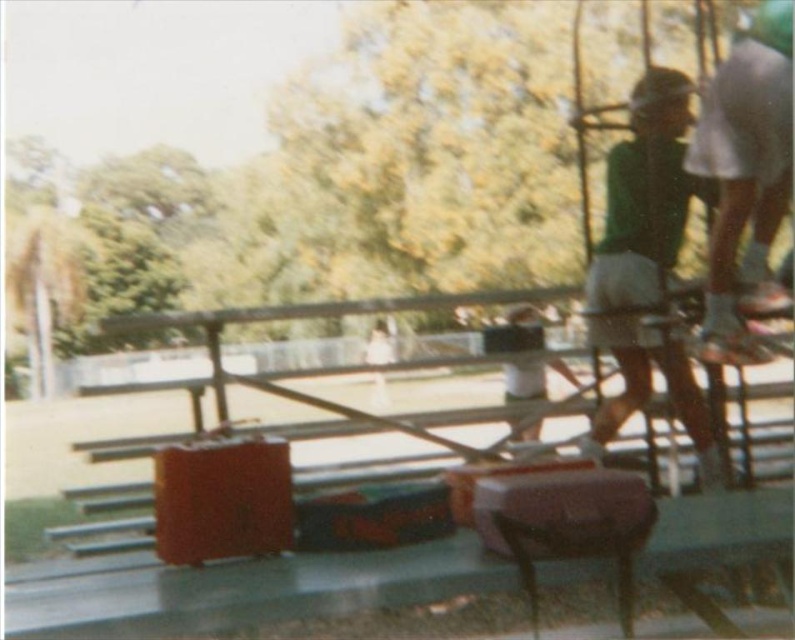
You are standing at the origin point of the coordinate system in the image. The bleachers are located at point 0.5, 0.5. Can you determine the direction of the green fabric shirt at right relative to the bleachers?

The green fabric shirt at right is located at point (642, 195), which is to the left and above the bleachers positioned at (397, 320). Therefore, the green fabric shirt at right is to the northwest of the bleachers.

Looking at this image, you are a delivery robot with a 1.5 meter wide package. You need to move between the green fabric shirt at right and the green fabric shirt at center. Is there enough space for you to pass through?

The distance between the green fabric shirt at right and the green fabric shirt at center is 1.61 meters, so yes, the robot can pass through since the package is 1.5 meters wide and the space is wider than the package.